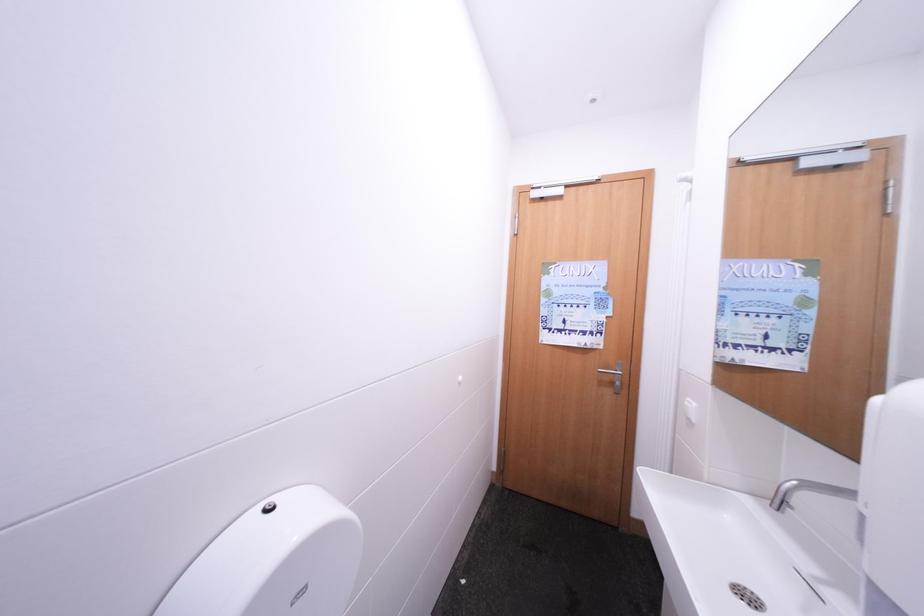
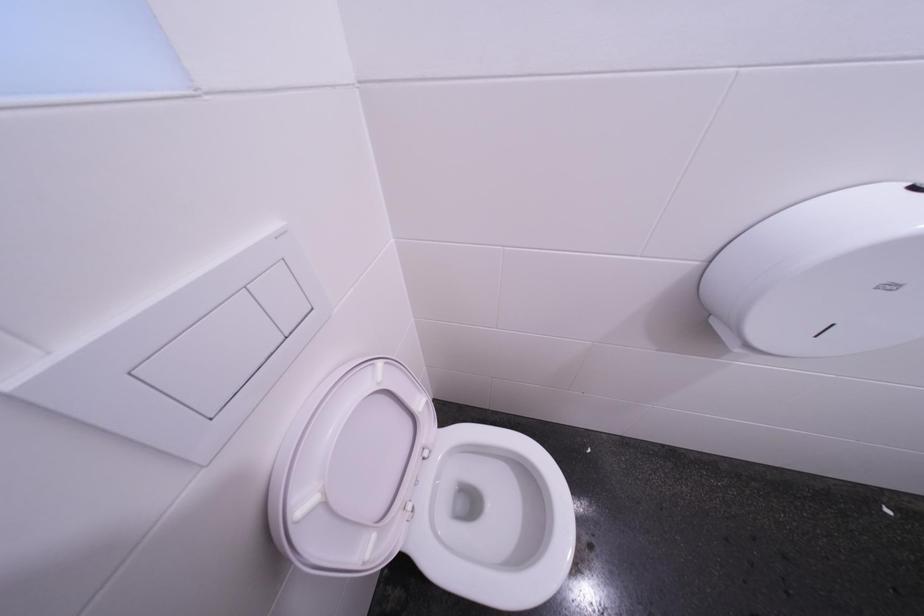
The images are taken continuously from a first-person perspective. In which direction is your viewpoint rotating?

The camera rotated toward left-down.